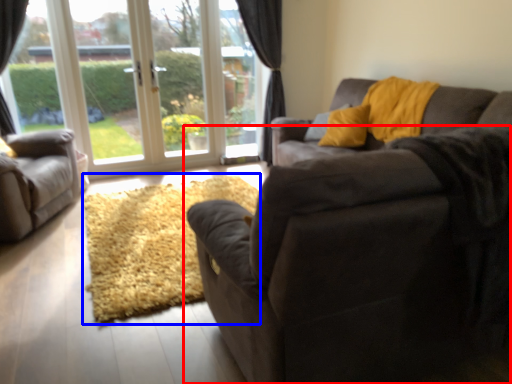
Question: Which object is closer to the camera taking this photo, studio couch (highlighted by a red box) or doormat (highlighted by a blue box)?

Choices:
 (A) studio couch
 (B) doormat

Answer: (A)